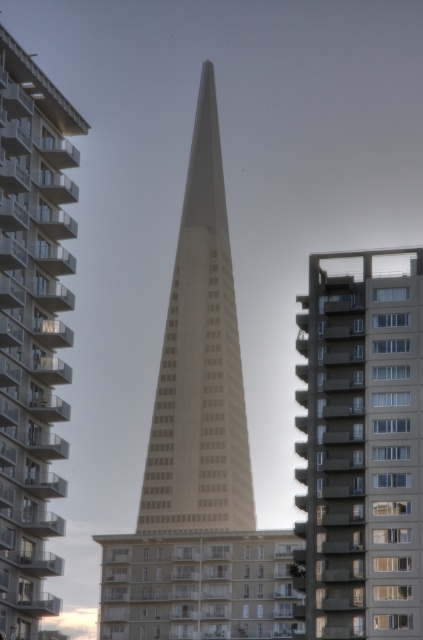
This screenshot has height=640, width=423. What do you see at coordinates (360, 445) in the screenshot?
I see `concrete building at center` at bounding box center [360, 445].

Which is more to the left, concrete building at center or beige concrete tower at center?

beige concrete tower at center is more to the left.

The height and width of the screenshot is (640, 423). Identify the location of concrete building at center. (360, 445).

Is beige concrete tower at center positioned in front of white concrete spire at center?

That is True.

Can you confirm if beige concrete tower at center is positioned below white concrete spire at center?

Indeed, beige concrete tower at center is positioned under white concrete spire at center.

The image size is (423, 640). Describe the element at coordinates (32, 330) in the screenshot. I see `beige concrete tower at center` at that location.

Image resolution: width=423 pixels, height=640 pixels. Find the location of `beige concrete tower at center`. beige concrete tower at center is located at coordinates (32, 330).

Can you confirm if concrete building at center is shorter than white concrete spire at center?

Yes.

Is concrete building at center in front of white concrete spire at center?

That is True.

Identify the location of concrete building at center. click(360, 445).

The height and width of the screenshot is (640, 423). I want to click on concrete building at center, so click(x=360, y=445).